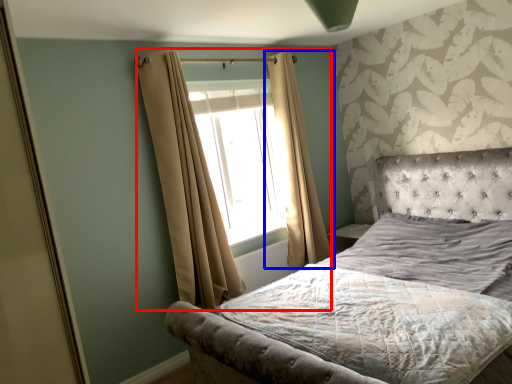
Question: Which object appears farthest to the camera in this image, curtain (highlighted by a red box) or curtain (highlighted by a blue box)?

Choices:
 (A) curtain
 (B) curtain

Answer: (B)